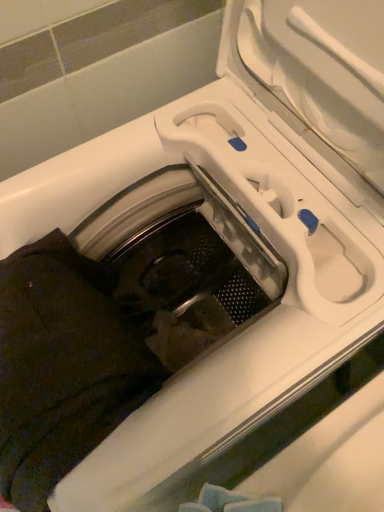
What do you see at coordinates (62, 366) in the screenshot? The height and width of the screenshot is (512, 384). I see `dark cotton shirt at lower left` at bounding box center [62, 366].

The image size is (384, 512). Identify the location of dark cotton shirt at lower left. (62, 366).

The width and height of the screenshot is (384, 512). I want to click on dark cotton shirt at lower left, so click(x=62, y=366).